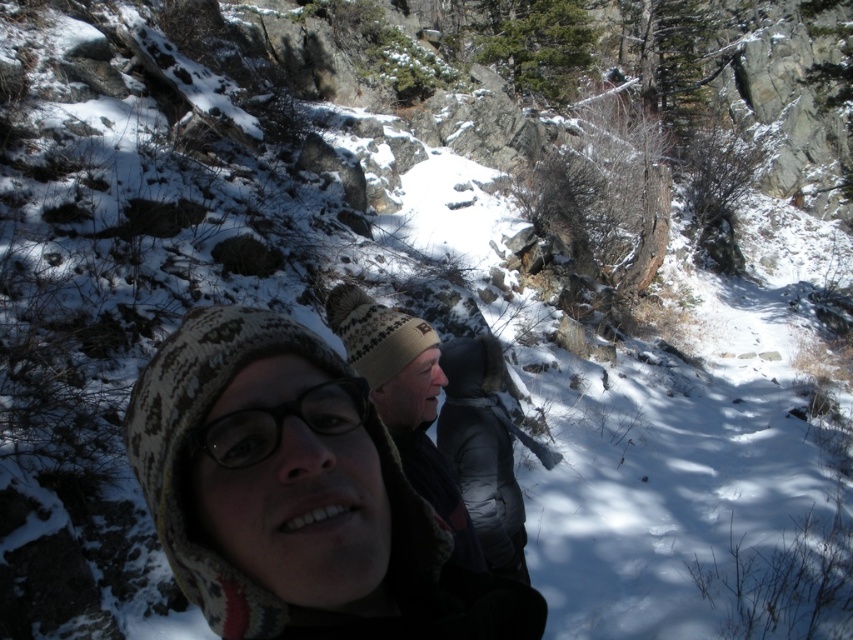
Looking at this image, you are trying to determine if a knitted wool hat at center can be placed on top of a black matte glasses at center without blocking the lenses. Based on their sizes and positions, is this possible?

The knitted wool hat at center might be wider than black matte glasses at center, so placing the hat on top of the glasses could potentially block the lenses due to its wider size.

You are standing in the snowy outdoor scene and want to walk towards the two points marked in the image. Which point, point (194,452) or point (305,420), will you reach first?

Point (194,452) is closer to the camera than point (305,420), so you will reach point (194,452) first.

You are holding a camera and want to take a photo of the knitted wool hat at center. If your camera has a minimum focusing distance of 40 inches, will you need to move closer or farther away to ensure the hat is in focus?

The knitted wool hat at center is currently 39.18 inches away from the camera. Since the minimum focusing distance is 40 inches, you need to move slightly farther away to ensure the hat is in focus.